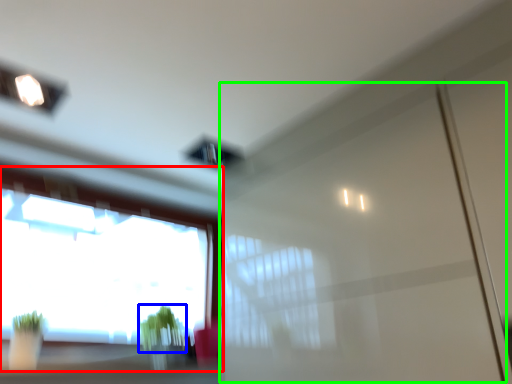
Question: Which is nearer to the window (highlighted by a red box)? plant (highlighted by a blue box) or screen door (highlighted by a green box).

Choices:
 (A) plant
 (B) screen door

Answer: (A)